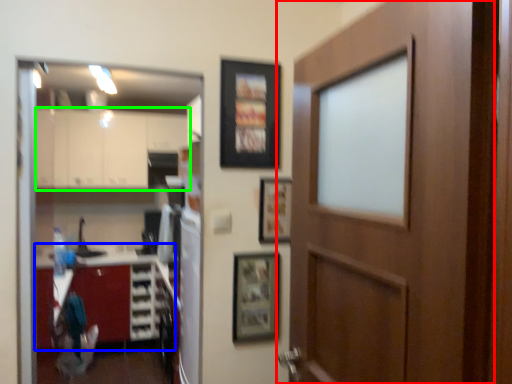
Question: Estimate the real-world distances between objects in this image. Which object is farther from door (highlighted by a red box), cabinetry (highlighted by a blue box) or cabinetry (highlighted by a green box)?

Choices:
 (A) cabinetry
 (B) cabinetry

Answer: (B)